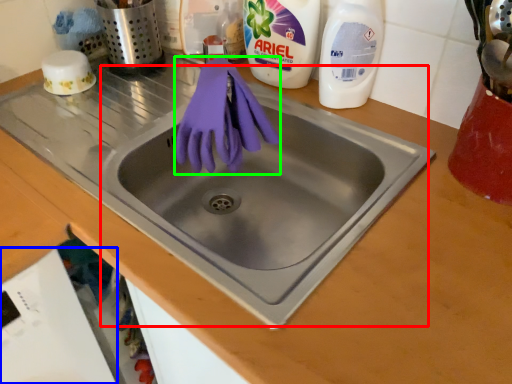
Question: Which object is the closest to the sink (highlighted by a red box)? Choose among these: dish washer (highlighted by a blue box) or glove (highlighted by a green box).

Choices:
 (A) dish washer
 (B) glove

Answer: (B)